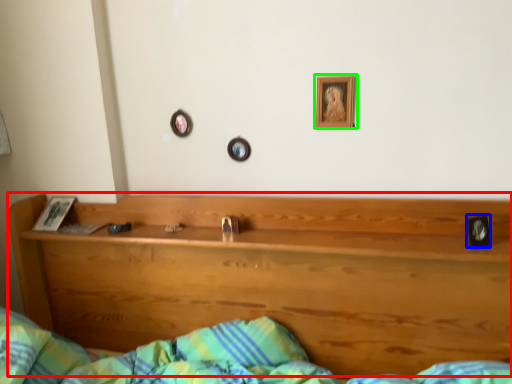
Question: Which object is positioned farthest from bunk bed (highlighted by a red box)? Select from picture frame (highlighted by a blue box) and picture frame (highlighted by a green box).

Choices:
 (A) picture frame
 (B) picture frame

Answer: (A)